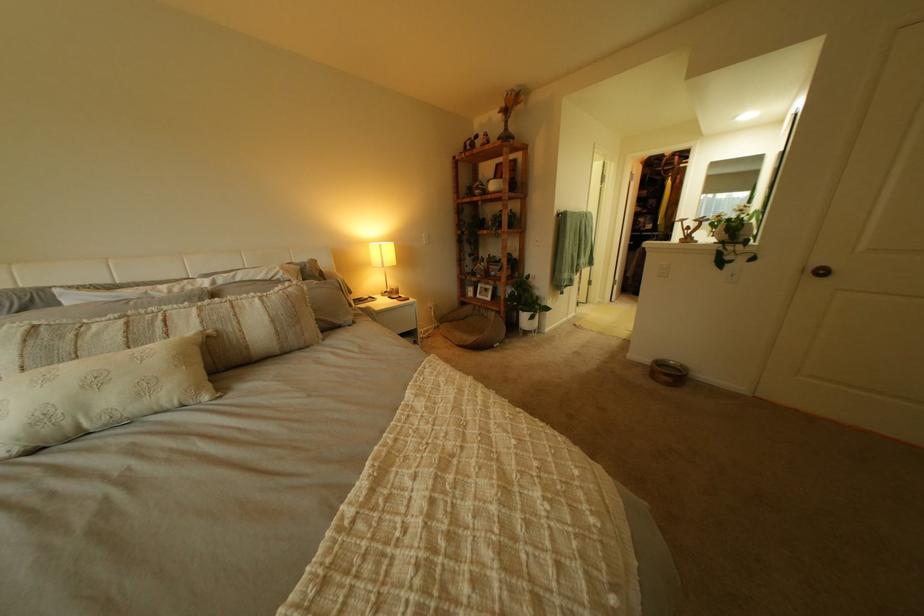
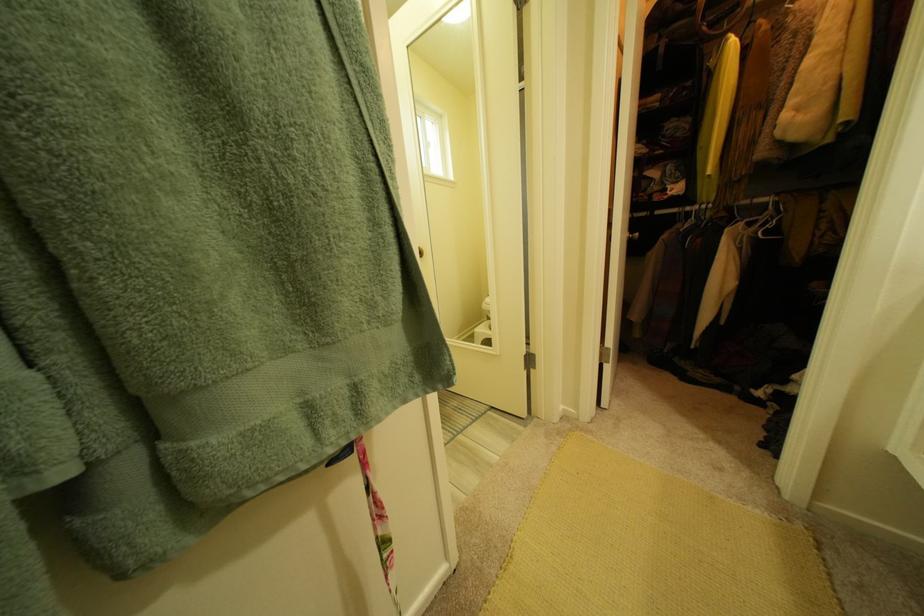
The images are taken continuously from a first-person perspective. In which direction are you moving?

The cameraman moved toward right, forward.